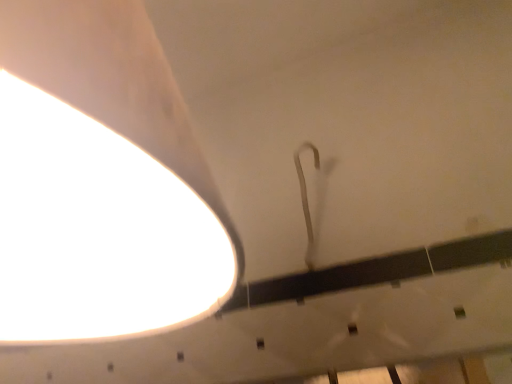
In order to face white glossy lampshade at upper left, should I rotate leftwards or rightwards?

You should rotate left by 24.457 degrees.

What are the coordinates of `white glossy lampshade at upper left` in the screenshot? It's located at (97, 230).

Describe the element at coordinates (97, 230) in the screenshot. I see `white glossy lampshade at upper left` at that location.

You are a GUI agent. You are given a task and a screenshot of the screen. Output one action in this format:
    pyautogui.click(x=<x>, y=<y>)
    Task: Click on the white glossy lampshade at upper left
    The width and height of the screenshot is (512, 384).
    Given the screenshot: What is the action you would take?
    pyautogui.click(x=97, y=230)